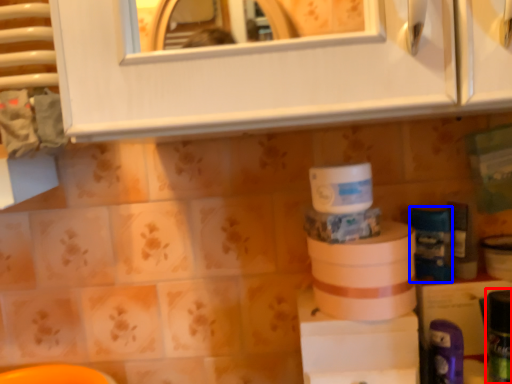
Question: Which object is further to the camera taking this photo, toiletry (highlighted by a red box) or toiletry (highlighted by a blue box)?

Choices:
 (A) toiletry
 (B) toiletry

Answer: (B)